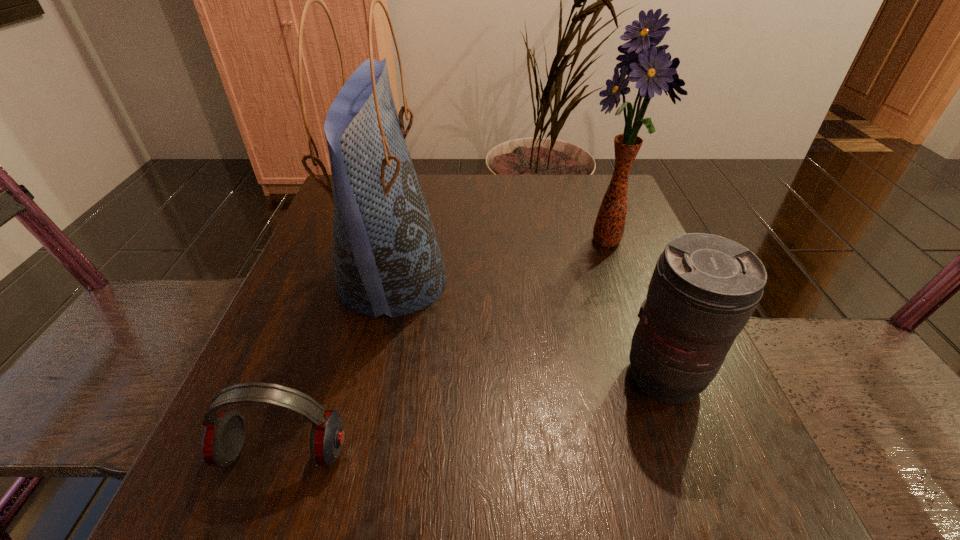
In order to click on object located at the near edge in this screenshot , I will do tap(223, 438).

The height and width of the screenshot is (540, 960). I want to click on shopping bag that is at the left edge, so click(x=387, y=260).

The height and width of the screenshot is (540, 960). What are the coordinates of `earphone situated at the left edge` in the screenshot? It's located at (223, 438).

I want to click on flower arrangement that is at the right edge, so [653, 70].

Where is `telephoto lens present at the right edge`? The image size is (960, 540). telephoto lens present at the right edge is located at coordinates (704, 289).

At what (x,y) coordinates should I click in order to perform the action: click on object located at the near left corner. Please return your answer as a coordinate pair (x, y). Looking at the image, I should click on click(223, 438).

Where is `object that is at the far right corner`? The image size is (960, 540). object that is at the far right corner is located at coordinates (653, 70).

Find the location of `vacant area at the far edge`. vacant area at the far edge is located at coordinates (431, 190).

Image resolution: width=960 pixels, height=540 pixels. Find the location of `vacant space at the near edge of the desktop`. vacant space at the near edge of the desktop is located at coordinates (335, 512).

In order to click on vacant space at the left edge in this screenshot , I will do `click(339, 343)`.